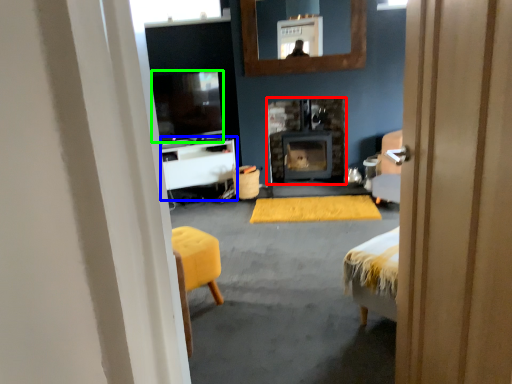
Question: Based on their relative distances, which object is nearer to wood burning stove (highlighted by a red box)? Choose from table (highlighted by a blue box) and television (highlighted by a green box).

Choices:
 (A) table
 (B) television

Answer: (A)